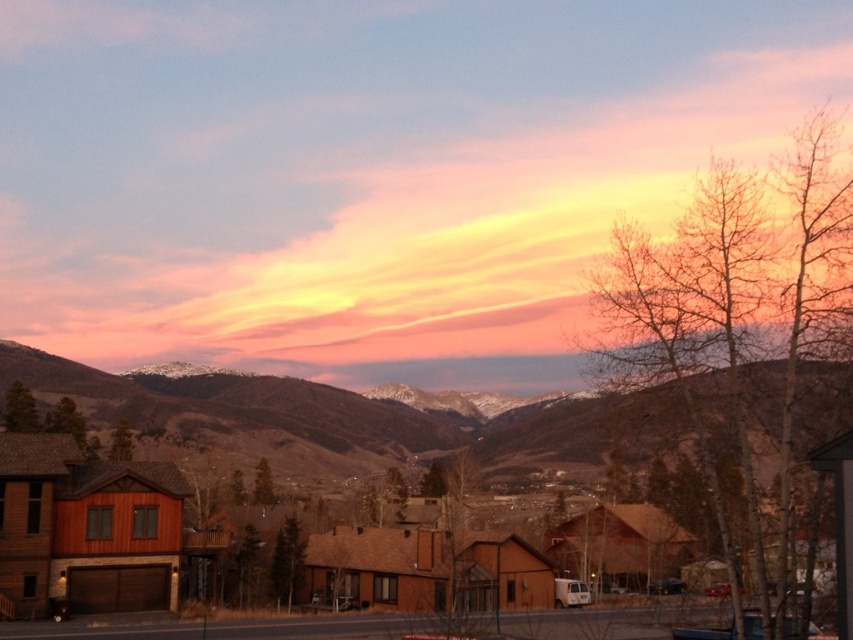
Question: Can you confirm if snow-covered mountain range at center is bigger than wooden cabin at lower left?

Choices:
 (A) yes
 (B) no

Answer: (A)

Question: Is the position of snow-covered mountain range at center more distant than that of wooden cabin at lower left?

Choices:
 (A) yes
 (B) no

Answer: (A)

Question: Observing the image, what is the correct spatial positioning of snow-covered mountain range at center in reference to wooden cabin at lower left?

Choices:
 (A) above
 (B) below

Answer: (A)

Question: Which of the following is the closest to the observer?

Choices:
 (A) (107, 406)
 (B) (158, 476)

Answer: (B)

Question: Which of the following is the closest to the observer?

Choices:
 (A) wooden cabin at lower left
 (B) snow-covered mountain range at center

Answer: (A)